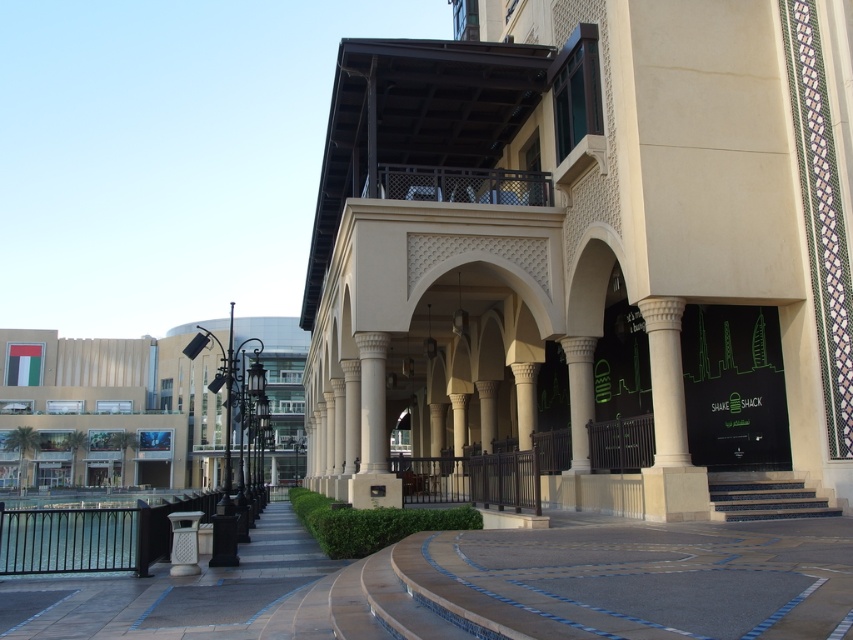
Question: Can you confirm if beige stone building at center is thinner than matte beige building at left?

Choices:
 (A) no
 (B) yes

Answer: (B)

Question: Which of the following is the farthest from the observer?

Choices:
 (A) (82, 381)
 (B) (827, 596)
 (C) (845, 161)
 (D) (575, 362)

Answer: (A)

Question: Which of these objects is positioned closest to the smooth stone pavement at center?

Choices:
 (A) white marble column at center
 (B) beige stone building at center
 (C) white stone column at center
 (D) matte beige building at left

Answer: (A)

Question: In this image, where is white marble column at center located relative to white marble pillar at center?

Choices:
 (A) left
 (B) right

Answer: (B)

Question: Can you confirm if beige stone building at center is wider than smooth stone pavement at center?

Choices:
 (A) no
 (B) yes

Answer: (B)

Question: Which of these objects is positioned closest to the white marble column at center?

Choices:
 (A) white stone column at center
 (B) smooth stone pavement at center

Answer: (B)